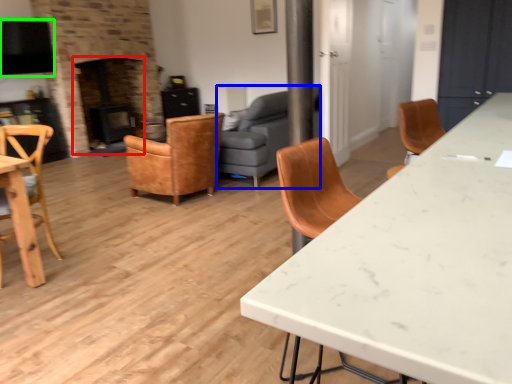
Question: Which object is the farthest from fireplace (highlighted by a red box)? Choose among these: studio couch (highlighted by a blue box) or exhaust hood (highlighted by a green box).

Choices:
 (A) studio couch
 (B) exhaust hood

Answer: (A)